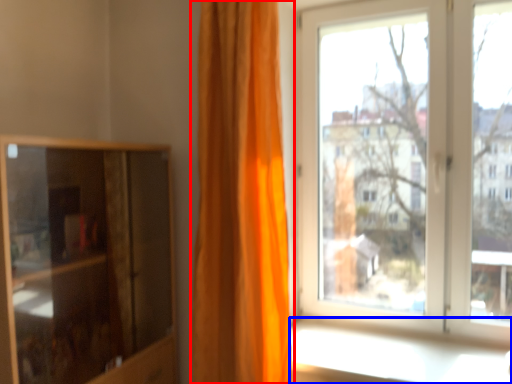
Question: Which object appears farthest to the camera in this image, curtain (highlighted by a red box) or window sill (highlighted by a blue box)?

Choices:
 (A) curtain
 (B) window sill

Answer: (A)